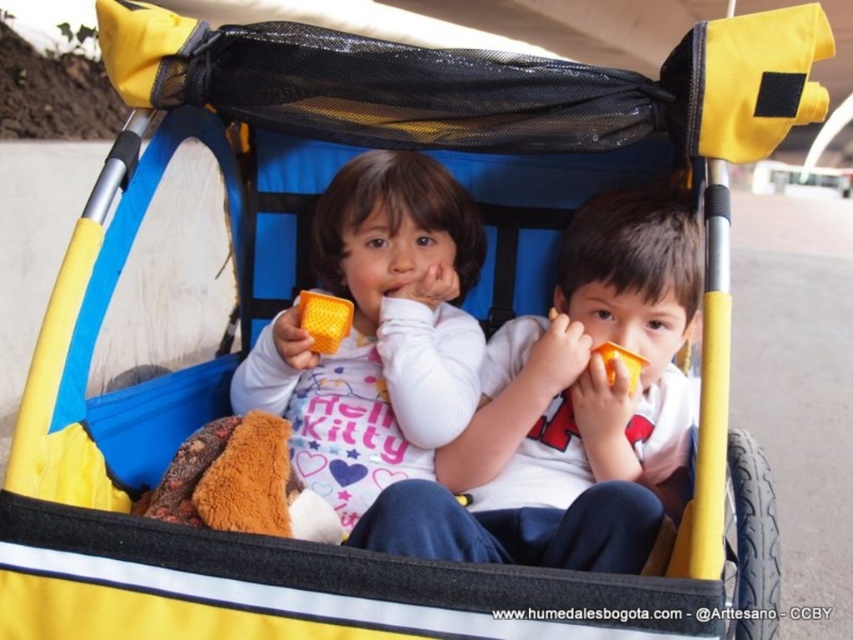
Does orange plastic cup at center appear on the left side of matte orange cup at center?

Incorrect, orange plastic cup at center is not on the left side of matte orange cup at center.

Who is more distant from viewer, (x=601, y=483) or (x=428, y=234)?

Point (x=428, y=234)

Identify the location of orange plastic cup at center. (570, 410).